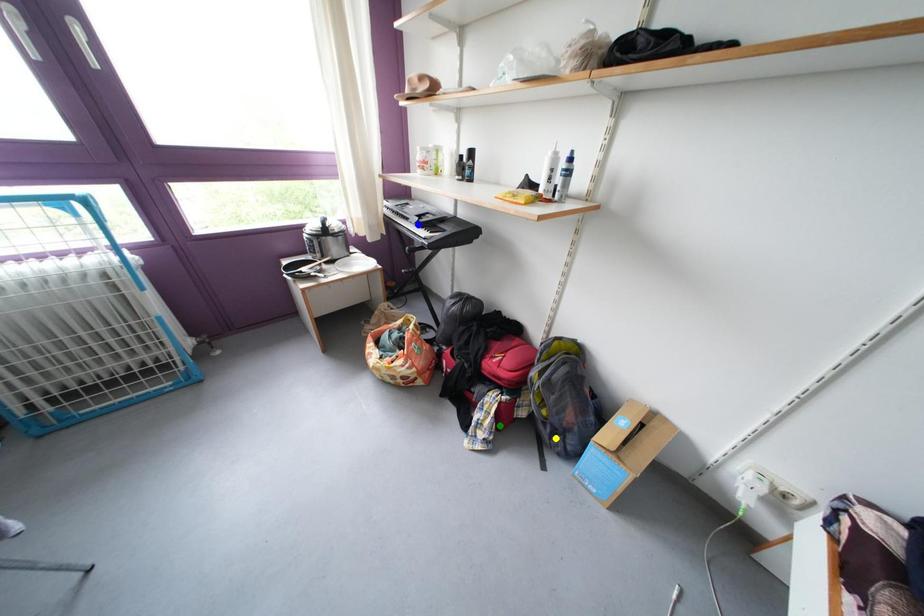
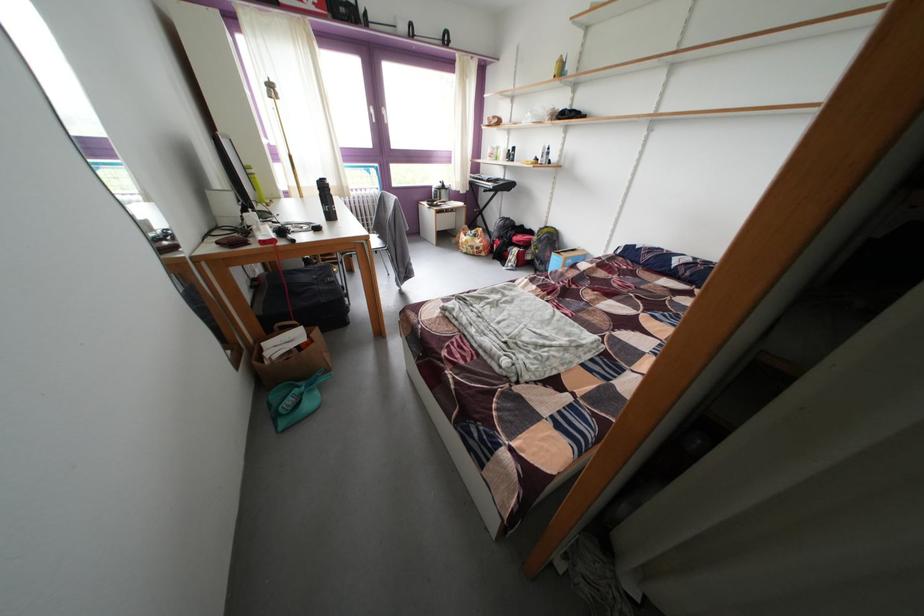
I am providing you with two images of the same scene from different viewpoints. Three points are marked in image1. Which point corresponds to a part or object that is occluded in image2?In image1, three points are marked. Which of them correspond to a part or object that is occluded in image2?Among the three points shown in image1, which one corresponds to a part or object that is no longer visible due to occlusion in image2?

Invisible in image2: green point.